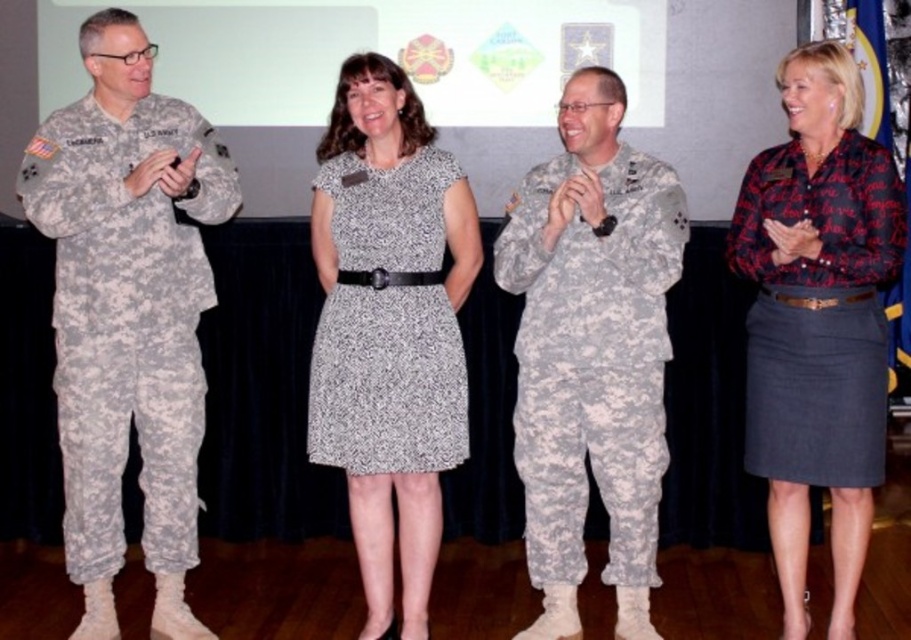
Question: Does camouflage uniform at center come in front of printed cotton blouse at center?

Choices:
 (A) yes
 (B) no

Answer: (B)

Question: Which object is the farthest from the speckled fabric dress at center?

Choices:
 (A) camouflage uniform at center
 (B) printed cotton blouse at center
 (C) camouflage uniform at left

Answer: (B)

Question: Can you confirm if camouflage uniform at center is bigger than printed cotton blouse at center?

Choices:
 (A) yes
 (B) no

Answer: (B)

Question: Considering the real-world distances, which object is closest to the printed cotton blouse at center?

Choices:
 (A) camouflage uniform at center
 (B) speckled fabric dress at center

Answer: (A)

Question: Is the position of camouflage uniform at center less distant than that of printed cotton blouse at center?

Choices:
 (A) no
 (B) yes

Answer: (A)

Question: Which of the following is the farthest from the observer?

Choices:
 (A) (610, 150)
 (B) (871, 244)
 (C) (113, 113)

Answer: (A)